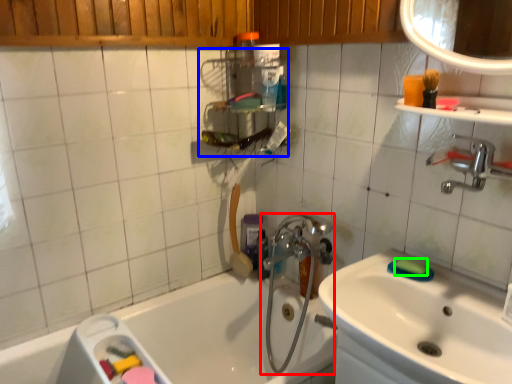
Question: Which object is positioned closest to plumbing fixture (highlighted by a red box)? Select from shelf (highlighted by a blue box) and soap (highlighted by a green box).

Choices:
 (A) shelf
 (B) soap

Answer: (A)